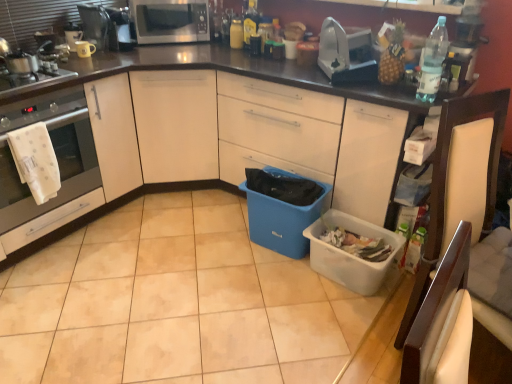
Locate an element on the screen. free region under white matte cabinet at center (from a real-world perspective) is located at coordinates (167, 292).